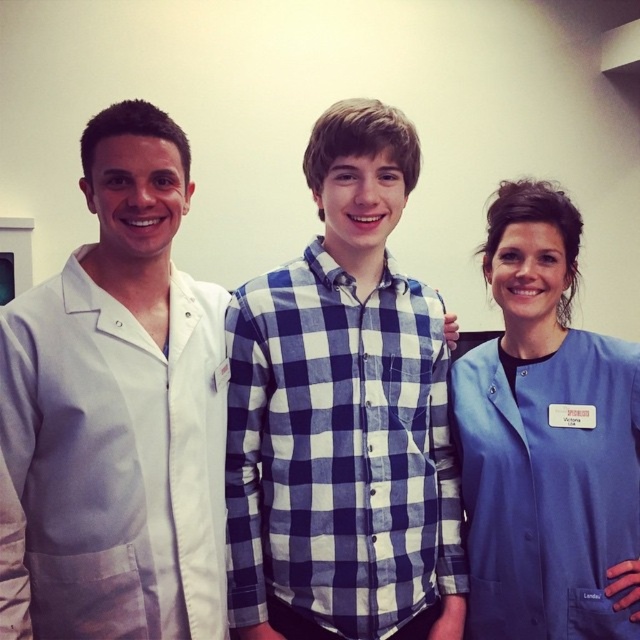
Is white cotton lab coat at center smaller than blue scrubs at center?

Indeed, white cotton lab coat at center has a smaller size compared to blue scrubs at center.

Can you confirm if white cotton lab coat at center is bigger than blue scrubs at center?

Actually, white cotton lab coat at center might be smaller than blue scrubs at center.

Between point (282, 536) and point (520, 448), which one is positioned behind?

Point (520, 448)

The image size is (640, 640). What are the coordinates of `white cotton lab coat at center` in the screenshot? It's located at (339, 451).

Is white smooth lab coat at left positioned before blue scrubs at center?

Yes, it is in front of blue scrubs at center.

Which is more to the left, white smooth lab coat at left or blue scrubs at center?

white smooth lab coat at left

Is point (60, 481) positioned before point (579, 461)?

Yes.

The height and width of the screenshot is (640, 640). In order to click on white smooth lab coat at left in this screenshot , I will do `click(116, 413)`.

Is white smooth lab coat at left below white cotton lab coat at center?

No.

Between point (148, 499) and point (276, 364), which one is positioned behind?

Positioned behind is point (276, 364).

Find the location of a particular element. The height and width of the screenshot is (640, 640). white smooth lab coat at left is located at coordinates tap(116, 413).